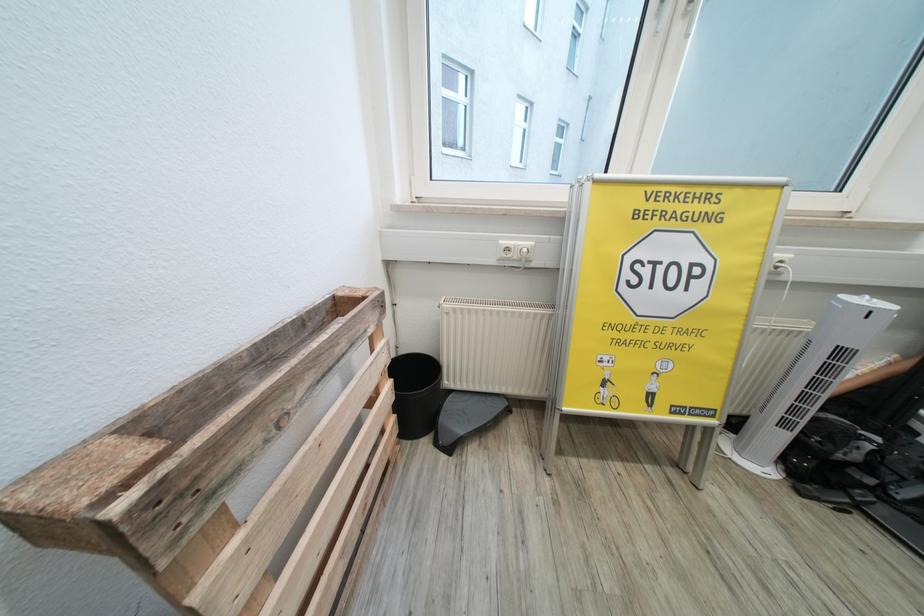
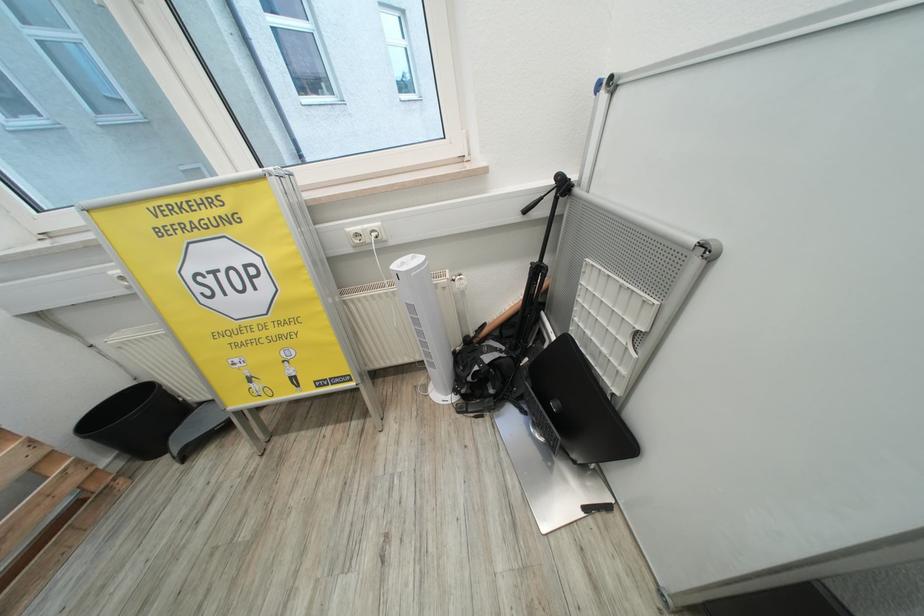
Question: In a continuous first-person perspective shot, in which direction is the camera moving?

Choices:
 (A) Left
 (B) Right
 (C) Forward
 (D) Backward

Answer: (B)